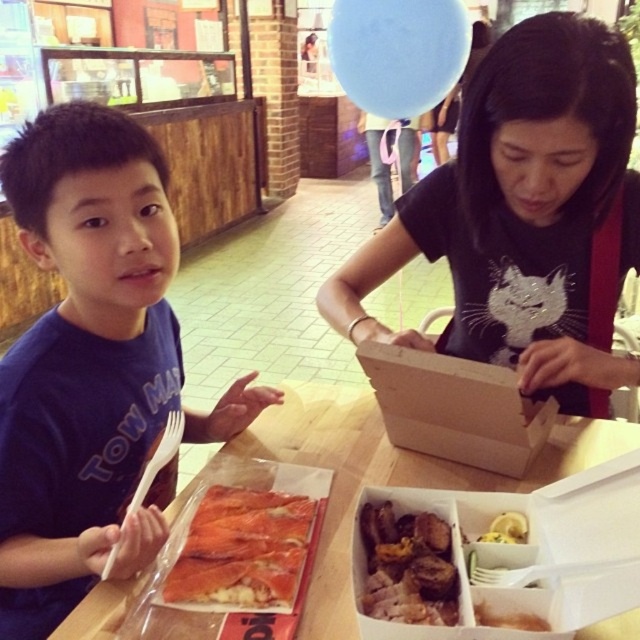
Question: Which point is farther from the camera taking this photo?

Choices:
 (A) (474, 140)
 (B) (384, 621)
 (C) (234, 420)

Answer: (C)

Question: Which point is closer to the camera taking this photo?

Choices:
 (A) (170, 216)
 (B) (397, 388)
 (C) (221, 589)
 (D) (417, 616)

Answer: (D)

Question: Is black matte shirt at center to the left of brown crispy meat at center from the viewer's perspective?

Choices:
 (A) yes
 (B) no

Answer: (B)

Question: Can you confirm if shiny salmon fillet at lower left is positioned below brown crispy meat at center?

Choices:
 (A) no
 (B) yes

Answer: (B)

Question: From the image, what is the correct spatial relationship of wooden table at center in relation to shiny salmon fillet at lower left?

Choices:
 (A) left
 (B) right

Answer: (B)

Question: Estimate the real-world distances between objects in this image. Which object is farther from the wooden table at center?

Choices:
 (A) brown crispy meat at center
 (B) blue matte shirt at left
 (C) wooden box at center
 (D) black matte shirt at center

Answer: (D)